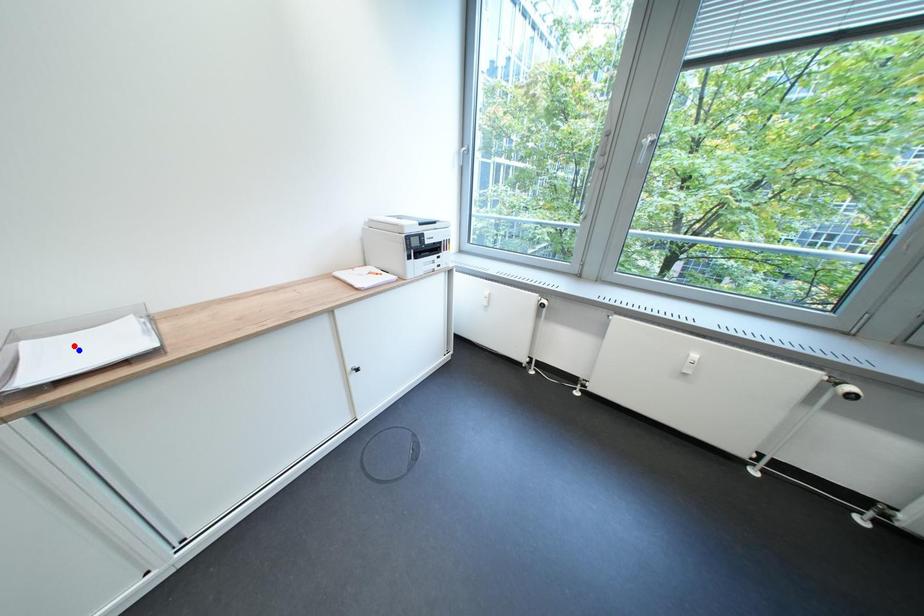
Question: Two points are marked on the image. Which point is closer to the camera?

Choices:
 (A) Blue point is closer.
 (B) Red point is closer.

Answer: (B)